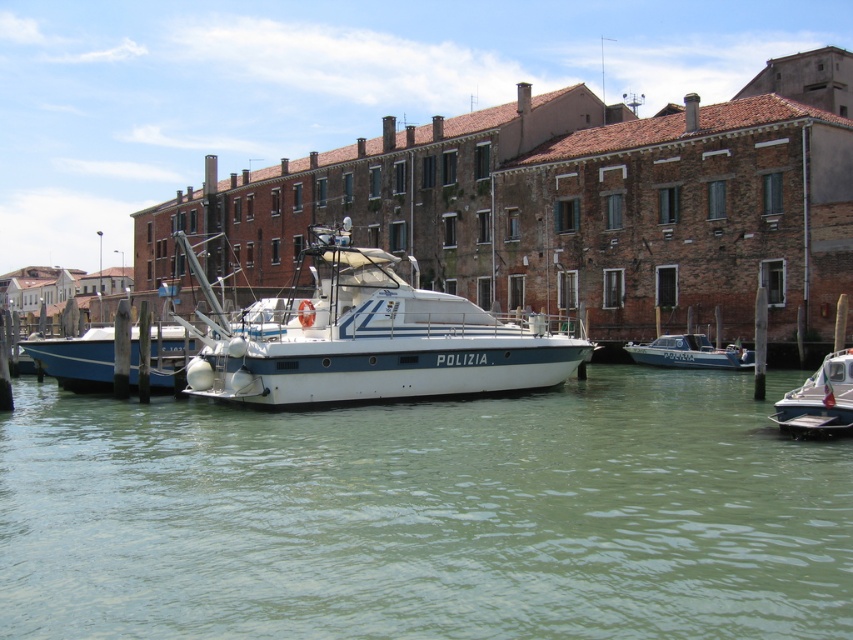
You are standing on the dock looking at the police boat marked POLIZIA. There are two points marked on the boat. Which point is closer to you, point at coordinate (154,371) or point at coordinate (850,349)?

Point at coordinate (154,371) is closer to you than point at coordinate (850,349) because it is further to the viewer according to the description.

What is located at the coordinates point (367, 339) in the serene waterway scene?

The white glossy boat at center is located at point (367, 339).